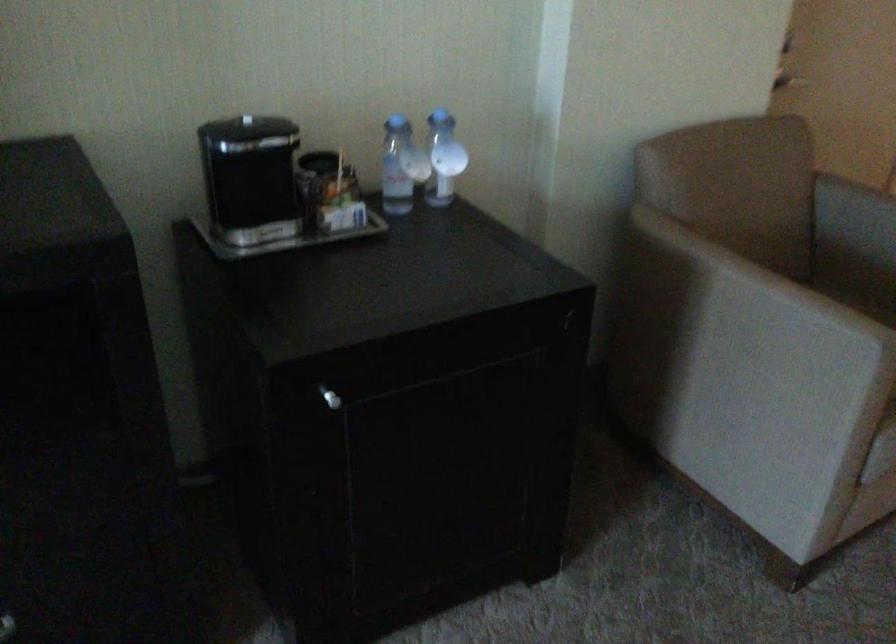
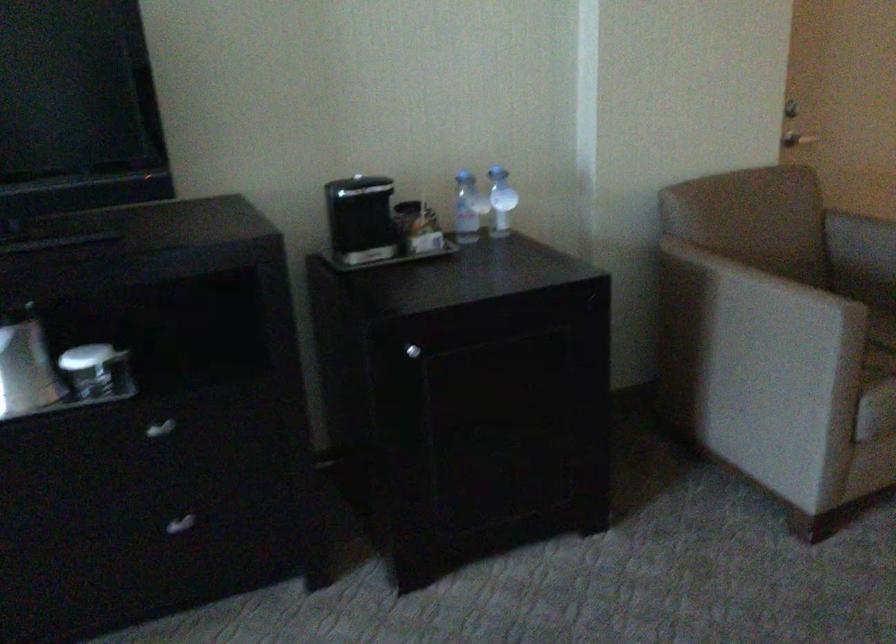
Question: The camera is either moving clockwise (left) or counter-clockwise (right) around the object. The first image is from the beginning of the video and the second image is from the end. Is the camera moving left or right when shooting the video?

Choices:
 (A) Left
 (B) Right

Answer: (B)